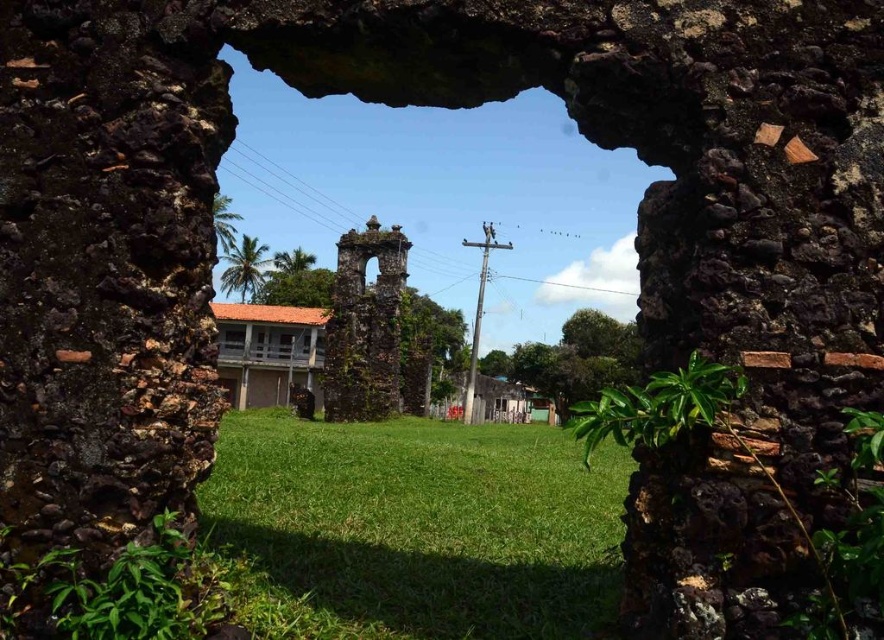
Question: Which of the following is the farthest from the observer?

Choices:
 (A) rusty stone arch at center
 (B) green grassy at center
 (C) clear glass window at center
 (D) transparent glass window at center

Answer: (D)

Question: Is green grassy at center positioned at the back of clear glass window at center?

Choices:
 (A) no
 (B) yes

Answer: (A)

Question: Is rusty stone arch at center below clear glass window at center?

Choices:
 (A) yes
 (B) no

Answer: (B)

Question: Based on their relative distances, which object is farther from the green grassy at center?

Choices:
 (A) rusty stone arch at center
 (B) clear glass window at center

Answer: (B)

Question: Which object is closer to the camera taking this photo?

Choices:
 (A) clear glass window at center
 (B) rusty stone arch at center
 (C) transparent glass window at center
 (D) green grassy at center

Answer: (D)

Question: Is green grassy at center in front of transparent glass window at center?

Choices:
 (A) yes
 (B) no

Answer: (A)